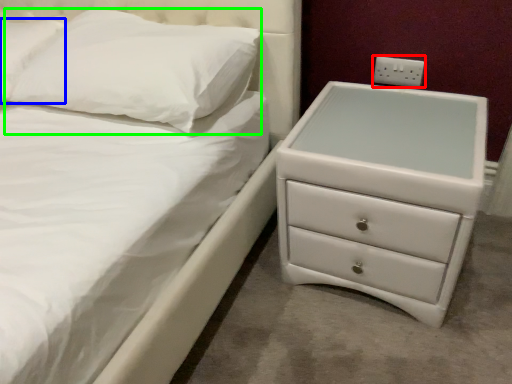
Question: Based on their relative distances, which object is farther from electric outlet (highlighted by a red box)? Choose from pillow (highlighted by a blue box) and pillow (highlighted by a green box).

Choices:
 (A) pillow
 (B) pillow

Answer: (A)